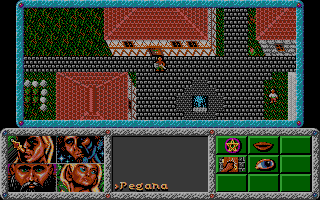
The height and width of the screenshot is (200, 320). Find the location of `door`. door is located at coordinates click(x=151, y=51).